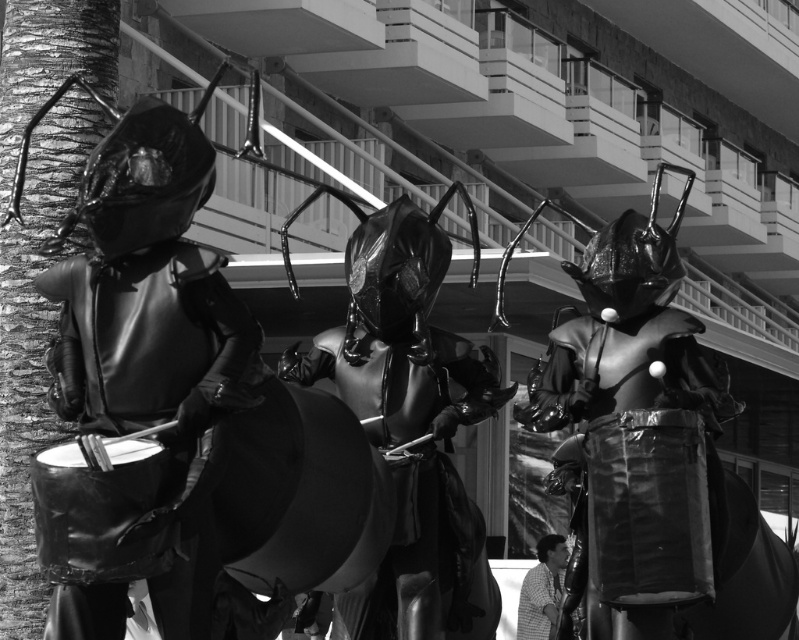
Question: Considering the real-world distances, which object is farthest from the glossy metallic ant at center?

Choices:
 (A) glossy black drum at left
 (B) glossy black drum at center

Answer: (A)

Question: Is the position of glossy black drum at left more distant than that of matte black costume at lower right?

Choices:
 (A) yes
 (B) no

Answer: (B)

Question: Which point appears closest to the camera in this image?

Choices:
 (A) (444, 480)
 (B) (110, 396)
 (C) (654, 289)

Answer: (B)

Question: Does glossy metallic ant at center appear on the left side of matte black costume at lower right?

Choices:
 (A) yes
 (B) no

Answer: (A)

Question: Which of these objects is positioned farthest from the glossy black drum at left?

Choices:
 (A) glossy black drum at center
 (B) matte black costume at lower right

Answer: (B)

Question: Where is glossy black drum at left located in relation to glossy black drum at center in the image?

Choices:
 (A) below
 (B) above

Answer: (B)